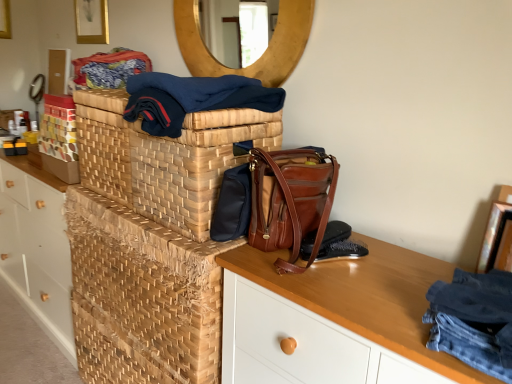
Image resolution: width=512 pixels, height=384 pixels. In order to click on vacant space situated above wooden desk at center (from a real-world perspective) in this screenshot , I will do `click(373, 286)`.